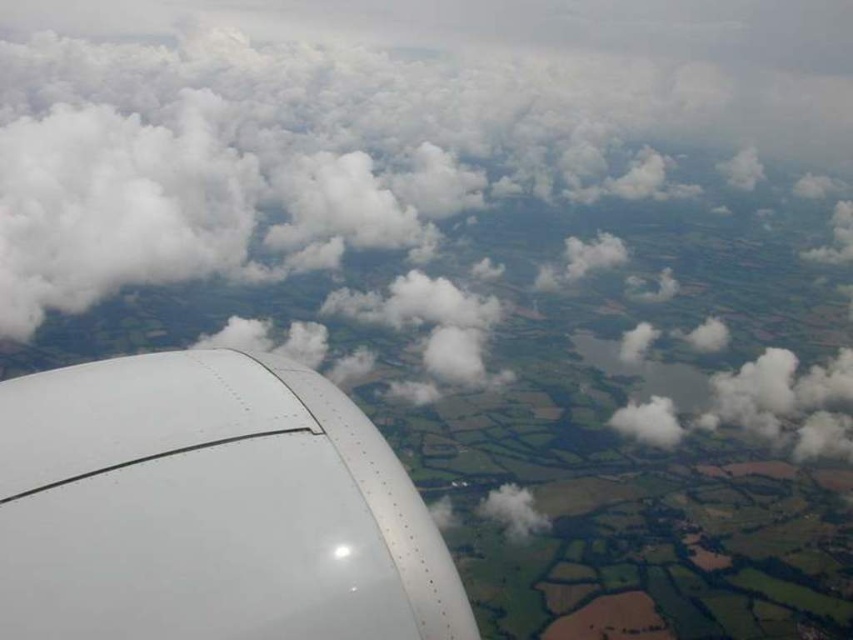
You are a pilot checking the view from the airplane window. You notice the white fluffy cloud at lower left and the white matte engine at lower left. Which object appears bigger in the scene?

The white fluffy cloud at lower left has a larger size compared to the white matte engine at lower left, so the white fluffy cloud at lower left appears bigger in the scene.

You are sitting in an airplane seat and looking out the window. You notice a white fluffy cloud at lower left. Can you determine if the point you are looking at, point (x=448, y=204), is located above or below the airplane wing?

The point (x=448, y=204) is located below the airplane wing because the white fluffy cloud at lower left is situated there, and clouds are typically below the wing during flight.

You are a passenger looking out the airplane window. You see the white fluffy cloud at lower left and the white matte engine at lower left. Which object is closer to the airplane window?

The white fluffy cloud at lower left is positioned over the white matte engine at lower left, meaning the cloud is closer to the airplane window than the engine.